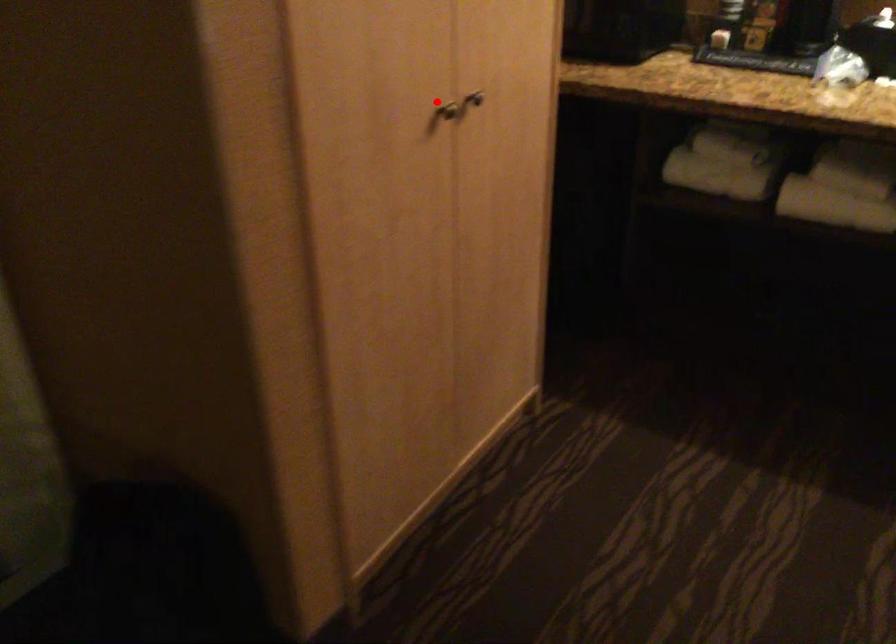
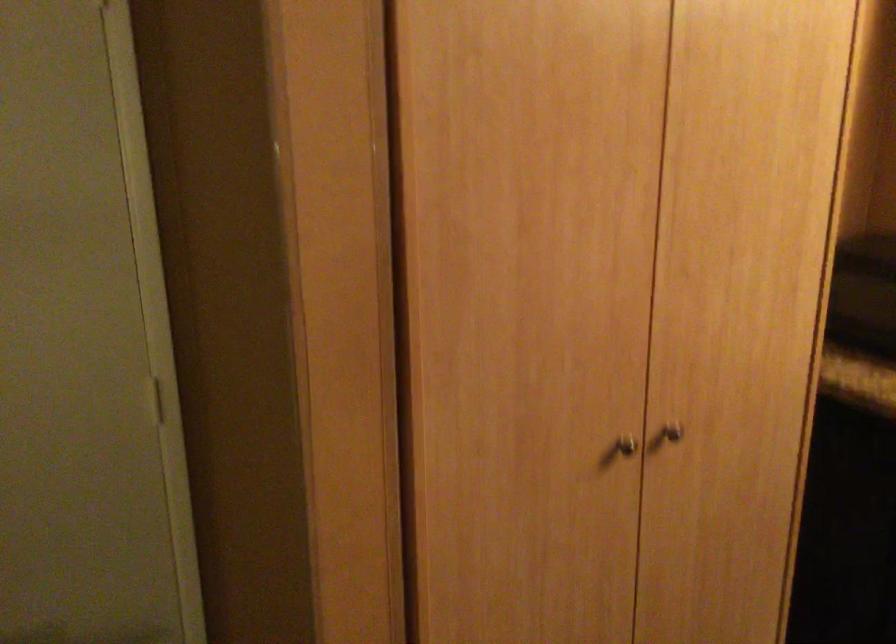
The point at the highlighted location is marked in the first image. Where is the corresponding point in the second image?

(625, 444)